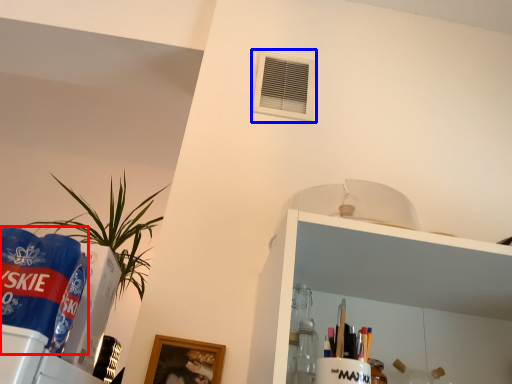
Question: Which point is further to the camera, beverage (highlighted by a red box) or air conditioning (highlighted by a blue box)?

Choices:
 (A) beverage
 (B) air conditioning

Answer: (B)